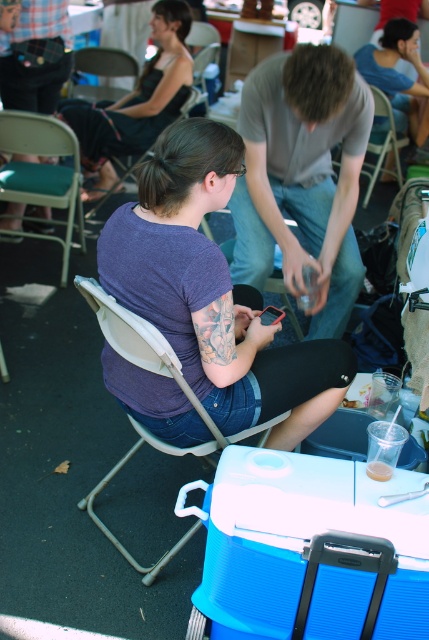
Consider the image. You need to sit down in the scene and want to choose between the metallic gray chair at upper left and the white plastic chair at center. Which chair has a wider seat to sit on?

The metallic gray chair at upper left is wider than the white plastic chair at center, so it has a wider seat to sit on.

You are standing at the origin point of the coordinate system in the image. A green fabric chair at left is located at point (42, 172). If you want to move towards the green fabric chair at left, which direction should you move in terms of the coordinate system?

To move towards the green fabric chair at left located at point (42, 172) from the origin, you should move in the positive x and positive y direction since the coordinates are both greater than zero.